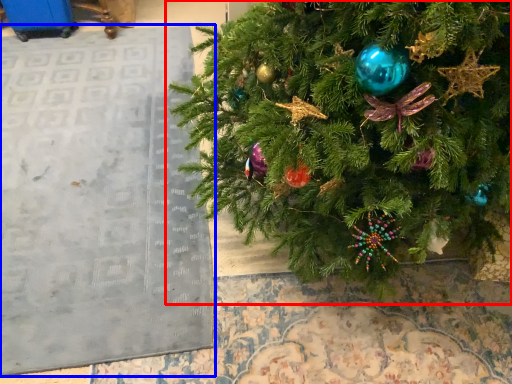
Question: Which object appears farthest to the camera in this image, christmas tree (highlighted by a red box) or bulletin board (highlighted by a blue box)?

Choices:
 (A) christmas tree
 (B) bulletin board

Answer: (B)